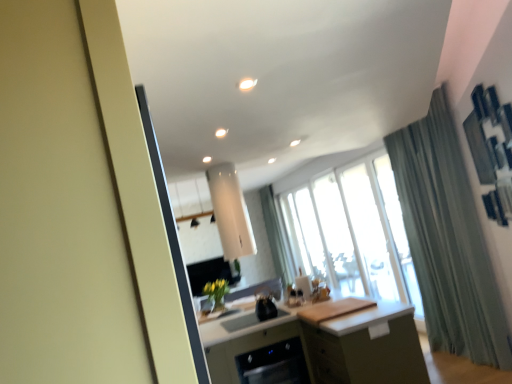
Identify the location of vacant area that is in front of white glossy light at upper center. (244, 72).